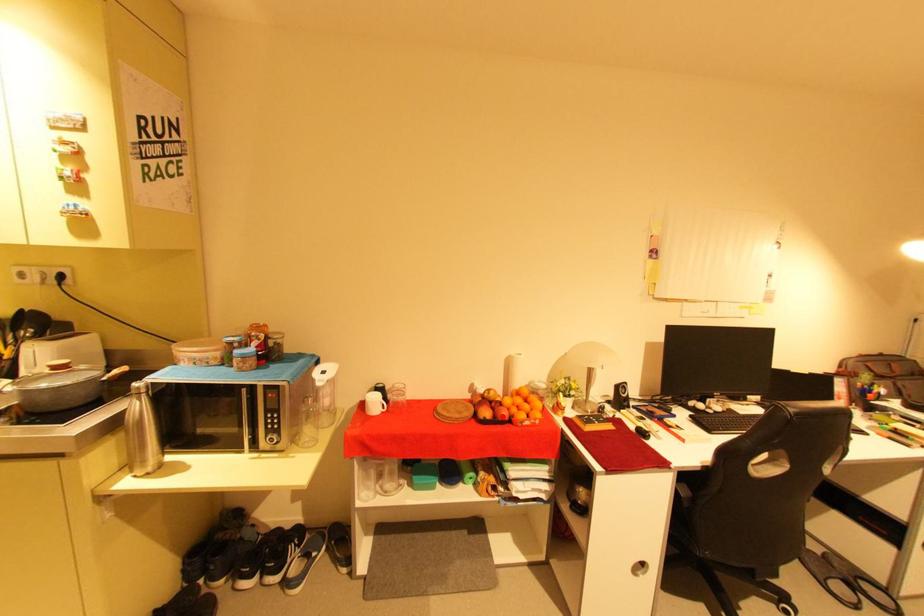
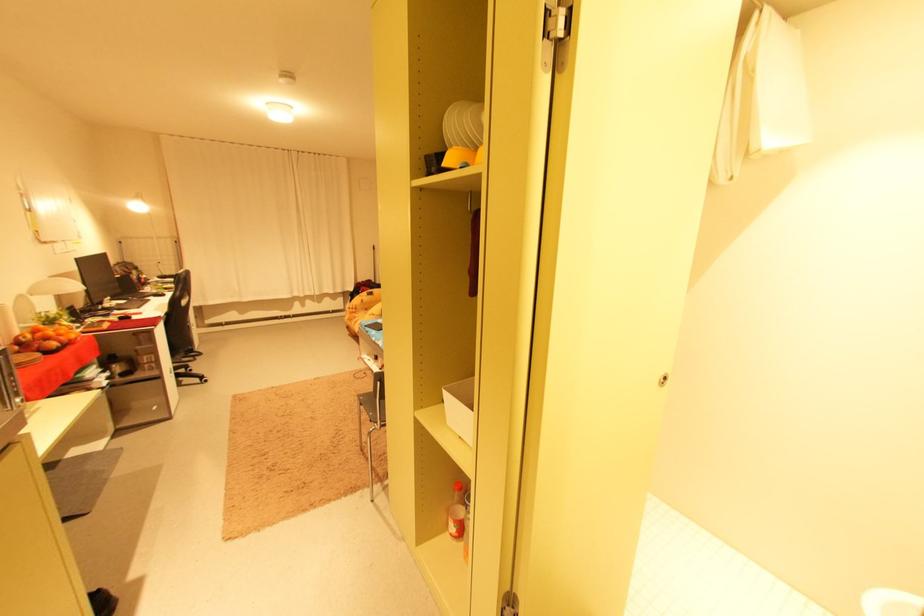
Where in the second image is the point corresponding to the highlighted location from the first image?

(68, 344)